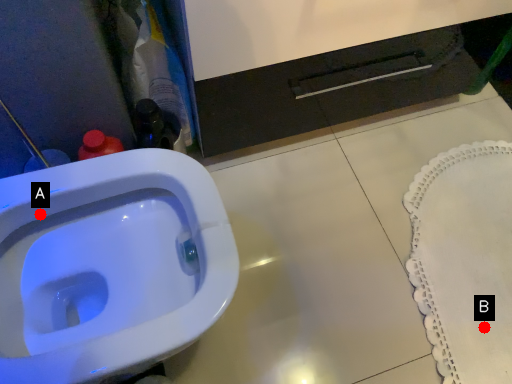
Question: Two points are circled on the image, labeled by A and B beside each circle. Which point is closer to the camera taking this photo?

Choices:
 (A) A is closer
 (B) B is closer

Answer: (A)